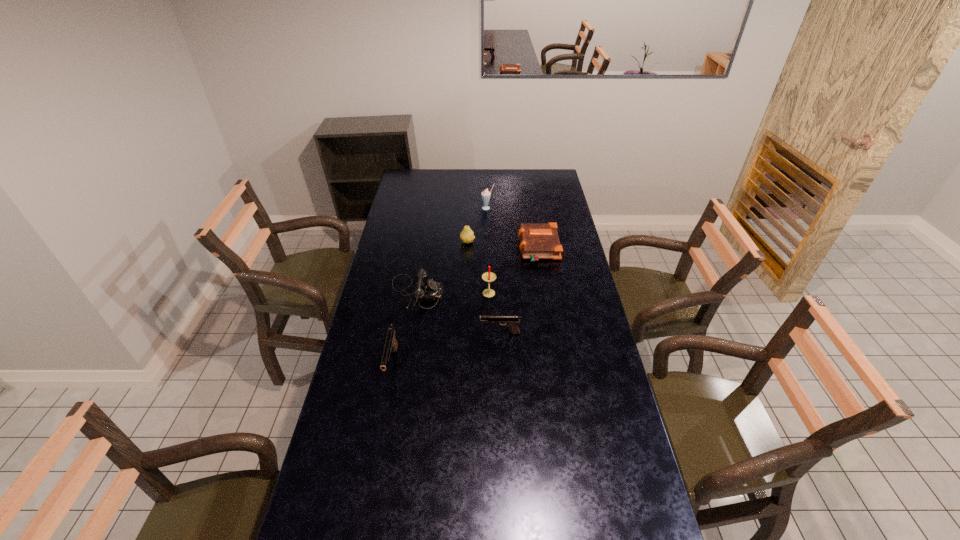
Where is `vacant space that satisfies the following two spatial constraints: 1. on the back side of the candle; 2. on the front-facing side of the telephone`? The image size is (960, 540). vacant space that satisfies the following two spatial constraints: 1. on the back side of the candle; 2. on the front-facing side of the telephone is located at coordinates (489, 293).